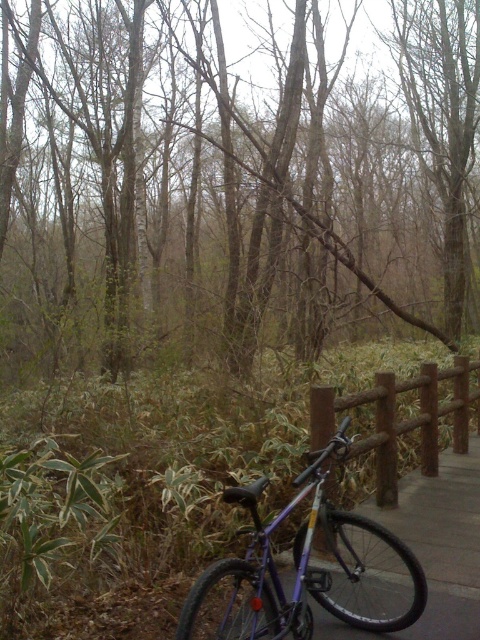
Question: Which point appears farthest from the camera in this image?

Choices:
 (A) (194, 595)
 (B) (101, 310)
 (C) (388, 500)

Answer: (B)

Question: Is brown matte tree at center bigger than brown wooden rail at right?

Choices:
 (A) yes
 (B) no

Answer: (A)

Question: Which of the following is the closest to the observer?

Choices:
 (A) purple matte mountain bike at center
 (B) brown matte tree at center

Answer: (A)

Question: Is brown matte tree at center thinner than brown wooden rail at right?

Choices:
 (A) no
 (B) yes

Answer: (A)

Question: Which of the following is the farthest from the observer?

Choices:
 (A) (261, 605)
 (B) (450, 372)
 (C) (251, 157)

Answer: (C)

Question: From the image, what is the correct spatial relationship of brown matte tree at center in relation to purple matte mountain bike at center?

Choices:
 (A) above
 (B) below

Answer: (A)